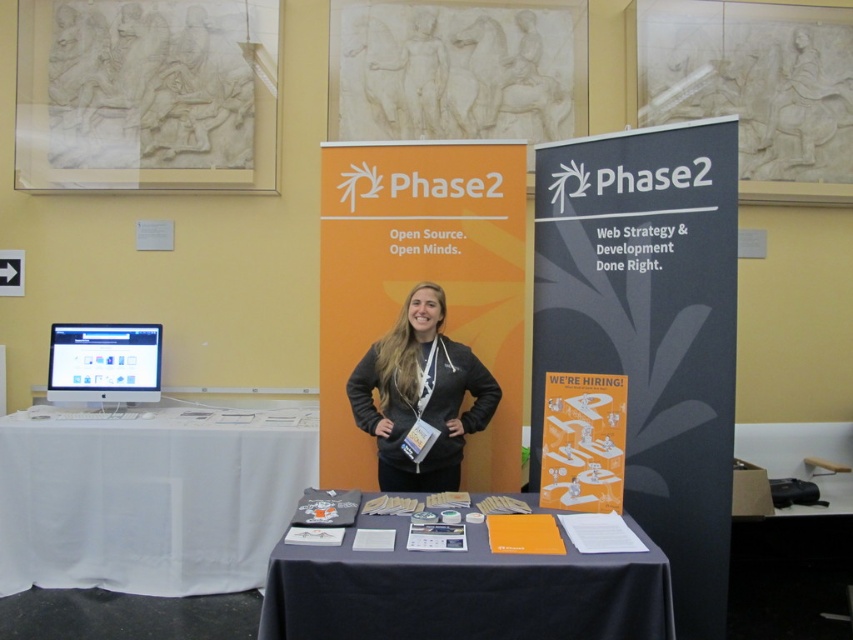
You are a visitor at the conference and want to place a 3 feet wide laptop between the orange paper at center and the matte silver monitor at left. Is there enough space for it?

The distance between the orange paper at center and the matte silver monitor at left is 7.40 feet, so yes, the 3 feet wide laptop can fit between them since the space is larger than the laptop.